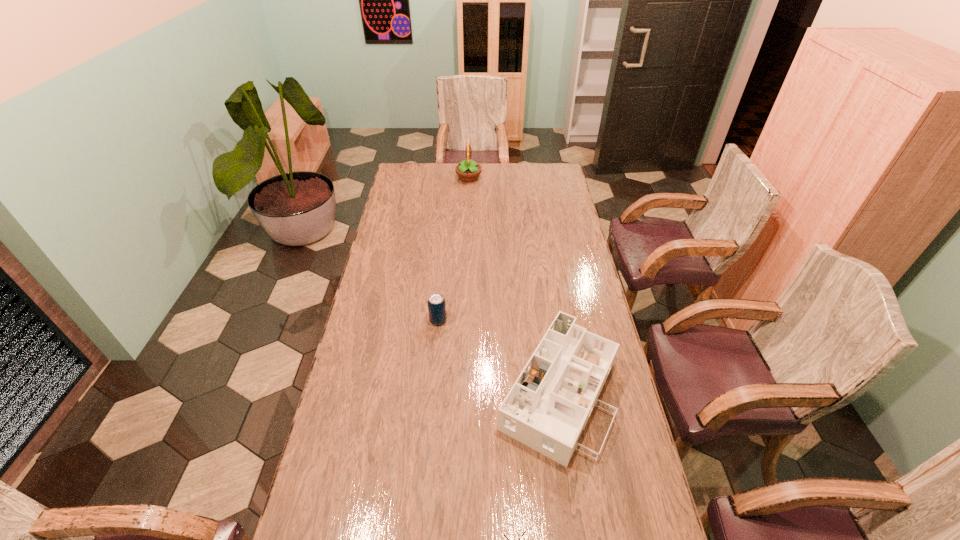
Find the location of a particular element. The height and width of the screenshot is (540, 960). vacant region at the left edge of the desktop is located at coordinates (385, 408).

At what (x,y) coordinates should I click in order to perform the action: click on blank space at the right edge of the desktop. Please return your answer as a coordinate pair (x, y). The width and height of the screenshot is (960, 540). Looking at the image, I should click on (543, 187).

Where is `vacant area at the far left corner`? The image size is (960, 540). vacant area at the far left corner is located at coordinates (405, 165).

At what (x,y) coordinates should I click in order to perform the action: click on free point at the far right corner. Please return your answer as a coordinate pair (x, y). Looking at the image, I should click on (x=544, y=165).

Identify the location of vacant area that lies between the dollhouse and the tallest object. The image size is (960, 540). (514, 285).

This screenshot has width=960, height=540. Find the location of `unoccupied area between the dollhouse and the tallest object`. unoccupied area between the dollhouse and the tallest object is located at coordinates (x=514, y=285).

The image size is (960, 540). Identify the location of vacant region between the soda can and the dollhouse. (498, 356).

The width and height of the screenshot is (960, 540). I want to click on vacant space that's between the dollhouse and the third nearest object, so click(498, 356).

At what (x,y) coordinates should I click in order to perform the action: click on vacant area that lies between the tallest object and the second nearest object. Please return your answer as a coordinate pair (x, y). Looking at the image, I should click on (514, 285).

You are a GUI agent. You are given a task and a screenshot of the screen. Output one action in this format:
    pyautogui.click(x=<x>, y=<y>)
    Task: Click on the empty space that is in between the second nearest object and the soda can
    This screenshot has height=540, width=960.
    Given the screenshot: What is the action you would take?
    pyautogui.click(x=498, y=356)